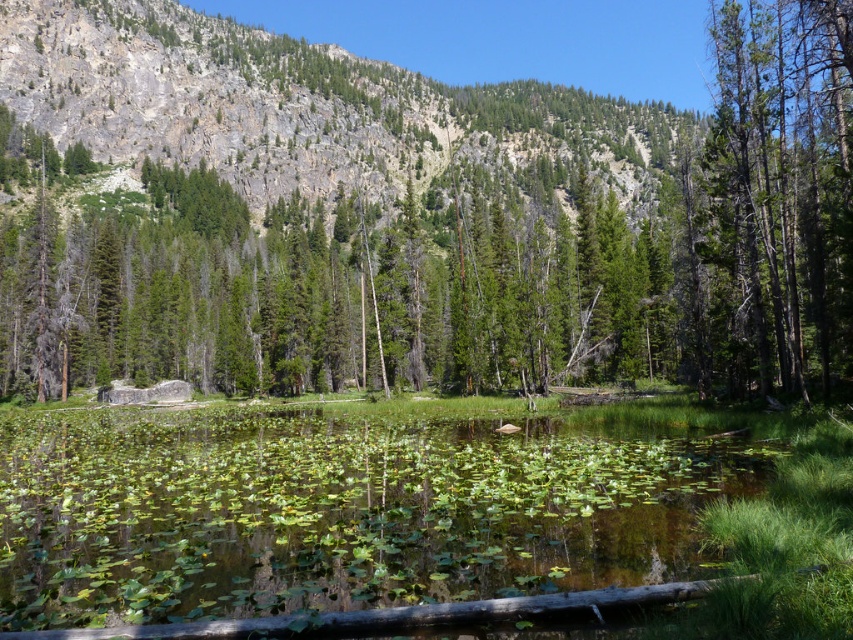
You are standing at the edge of the forest and want to cross the water to reach the tree. Which direction should you head towards to go from the green leafy water at center to the green matte tree at right?

You should head to the right because the green leafy water at center is to the left of the green matte tree at right, so moving right will lead you towards the tree.

Please provide the 2D coordinates of the green leafy water at center in the image. The answer should be in the format of a coordinate pair enclosed in parentheses, such as 0.5, 0.5. The coordinate system is normalized, meaning that the top left corner of the image is at 0,0 and the bottom right corner is at 1,1.

The 2D coordinates of the green leafy water at center are at point (338, 509).

You are standing at the edge of the water in the serene landscape and want to reach both the point at coordinates point (474, 147) and point (849, 102). Which point will you reach first as you walk towards them?

You will reach point (474, 147) first because it is closer to you than point (849, 102), which is further away.